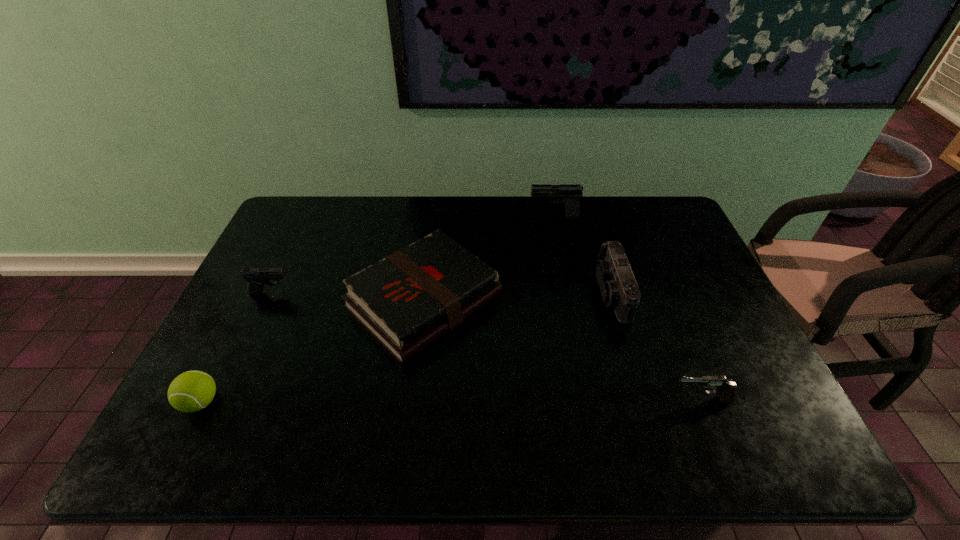
This screenshot has height=540, width=960. I want to click on the farthest pistol, so coord(571,192).

Locate an element on the screen. This screenshot has height=540, width=960. the second pistol from right to left is located at coordinates (571, 192).

The width and height of the screenshot is (960, 540). Identify the location of camcorder. (616, 281).

Locate an element on the screen. This screenshot has height=540, width=960. hardback book is located at coordinates (408, 300).

Find the location of a particular element. Image resolution: width=960 pixels, height=540 pixels. the nearest pistol is located at coordinates (726, 389).

I want to click on the rightmost pistol, so click(726, 389).

What are the coordinates of `the leftmost pistol` in the screenshot? It's located at (257, 277).

Where is `tennis ball`? This screenshot has width=960, height=540. tennis ball is located at coordinates (191, 391).

Image resolution: width=960 pixels, height=540 pixels. In order to click on vacant space positioned aim along the barrel of the second pistol from left to right in this screenshot , I will do tap(489, 217).

Image resolution: width=960 pixels, height=540 pixels. I want to click on vacant area situated 0.270m aim along the barrel of the second pistol from left to right, so click(451, 217).